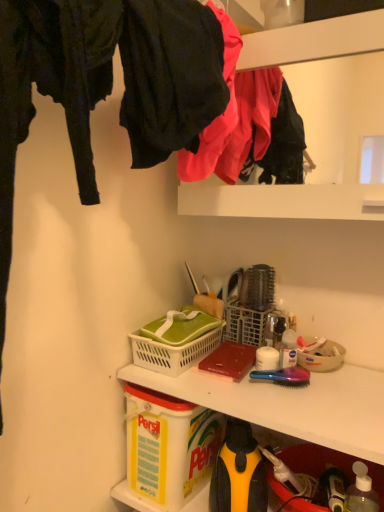
This screenshot has height=512, width=384. I want to click on free space in front of beige plastic bowl at center right, so click(x=332, y=402).